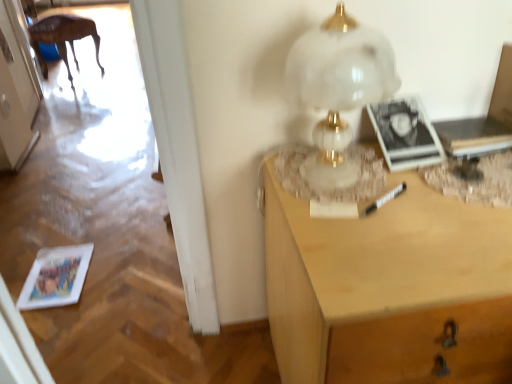
Where is `free space to the left of matte paper magazine at lower left`? The image size is (512, 384). free space to the left of matte paper magazine at lower left is located at coordinates (14, 261).